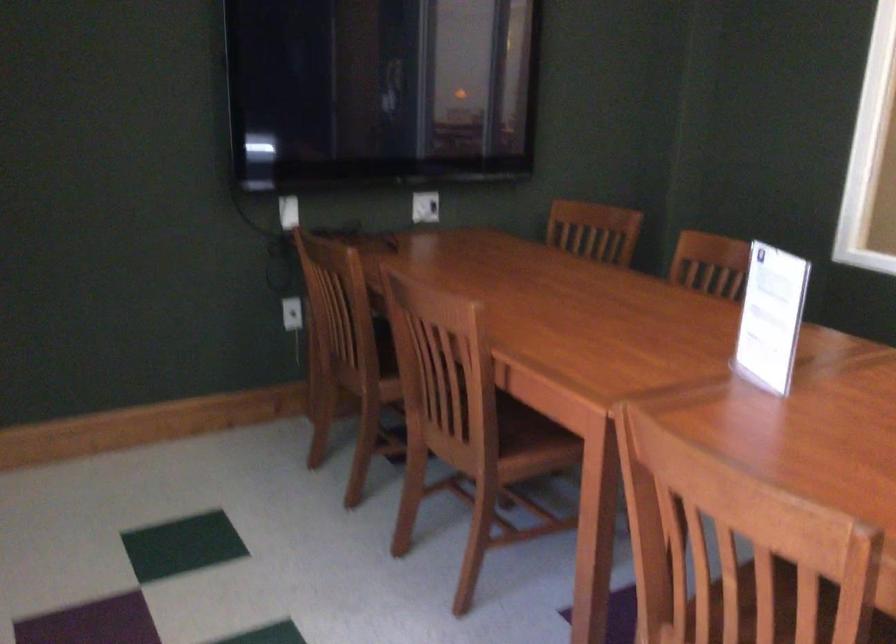
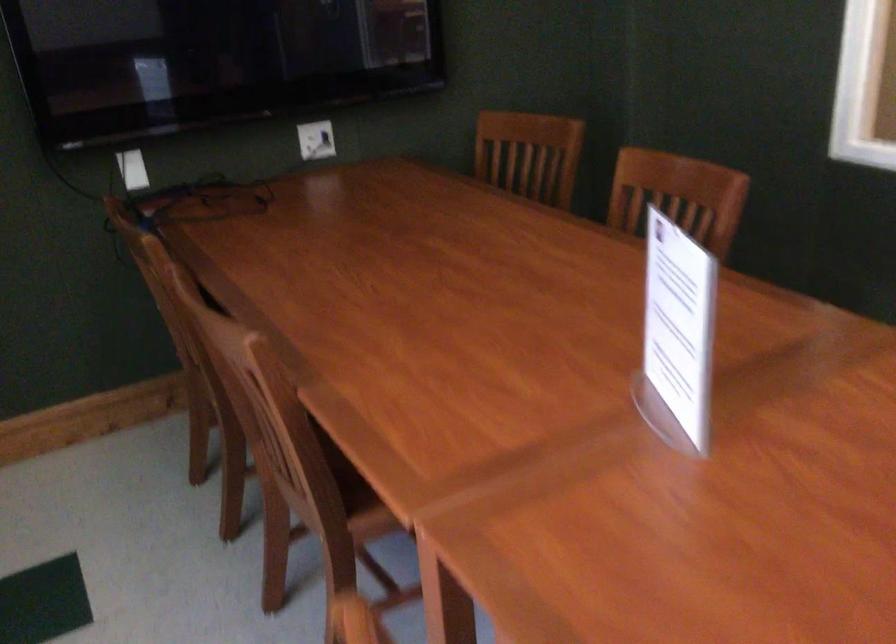
Locate, in the second image, the point that corresponds to the point at 729,261 in the first image.

(677, 196)